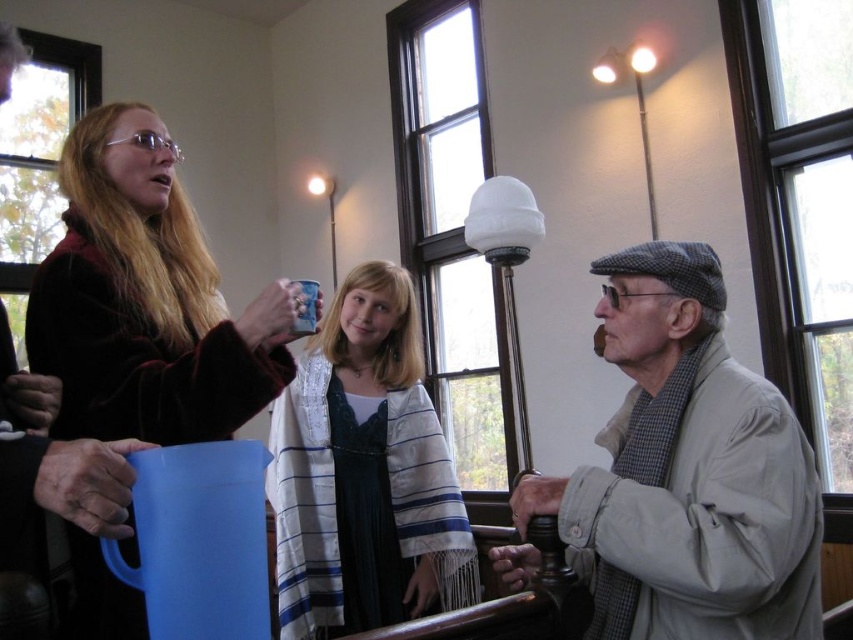
You are a guest at a party and want to place your blue matte mug at center on the white striped shawl at center. Can the mug fit on the shawl?

The white striped shawl at center is wider than the blue matte mug at center, so the mug can fit on the shawl.

You are a guest at a party and see the velvet maroon coat at upper left and the blue plastic mug at upper left. Which object would you need to move first to reach the lamp in the center?

The velvet maroon coat at upper left is larger in size than the blue plastic mug at upper left, so you would need to move the smaller blue plastic mug at upper left first to reach the lamp in the center.

You are standing in the room and want to place a small object on the point that is closer to you. Which point should you choose between point (x=113, y=104) and point (x=247, y=541)?

Point (x=247, y=541) is closer to you, so you should choose point (x=247, y=541) to place the small object.